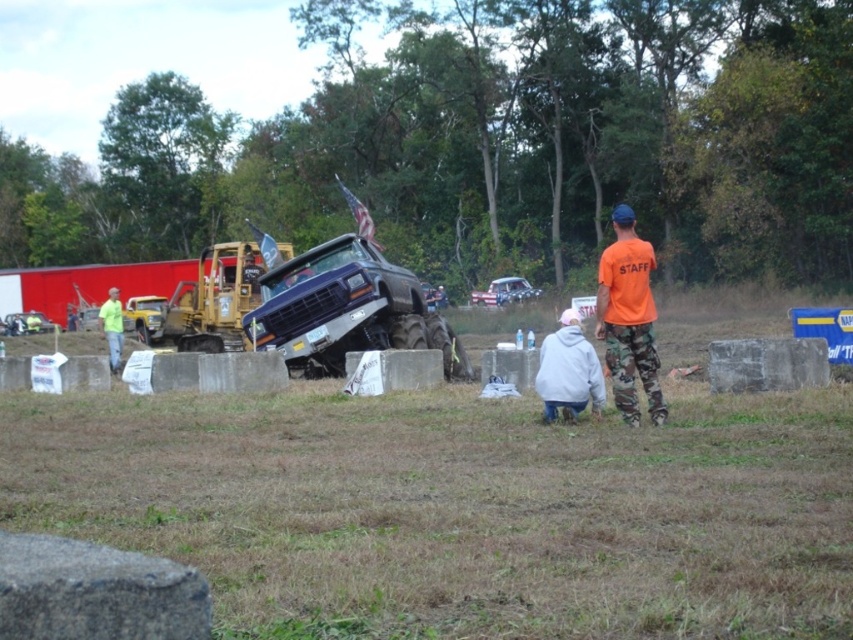
Does gray fleece jacket at center appear on the right side of neon yellow jacket at left?

Indeed, gray fleece jacket at center is positioned on the right side of neon yellow jacket at left.

Based on the photo, who is shorter, gray fleece jacket at center or neon yellow jacket at left?

gray fleece jacket at center

Find the location of a particular element. The height and width of the screenshot is (640, 853). gray fleece jacket at center is located at coordinates (567, 371).

Is metallic purple truck at center shorter than orange t-shirt at right?

Correct, metallic purple truck at center is not as tall as orange t-shirt at right.

Between point (265, 316) and point (622, 381), which one is positioned in front?

Point (622, 381) is in front.

Image resolution: width=853 pixels, height=640 pixels. I want to click on metallic purple truck at center, so click(346, 310).

Can you confirm if gray fleece jacket at center is positioned above brushed metal car at left?

Yes, gray fleece jacket at center is above brushed metal car at left.

Who is more forward, (550, 400) or (32, 317)?

Point (550, 400) is more forward.

Find the location of a particular element. Image resolution: width=853 pixels, height=640 pixels. gray fleece jacket at center is located at coordinates (567, 371).